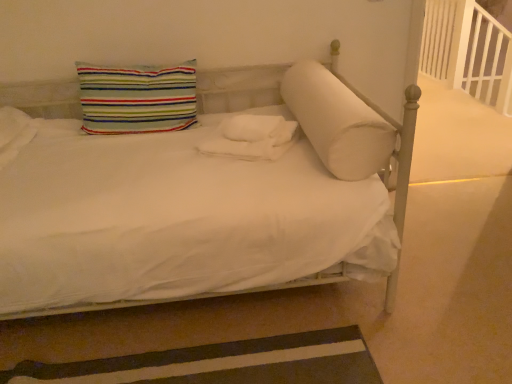
Locate an element on the screen. free spot to the right of brown striped rug at lower left is located at coordinates (387, 316).